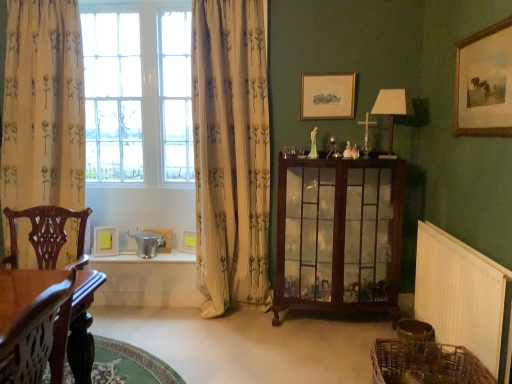
At what (x,y) coordinates should I click in order to perform the action: click on vacant area that is in front of yellow paper at window, the 3th picture frame from the back. Please return your answer as a coordinate pair (x, y). The image size is (512, 384). Looking at the image, I should click on (101, 259).